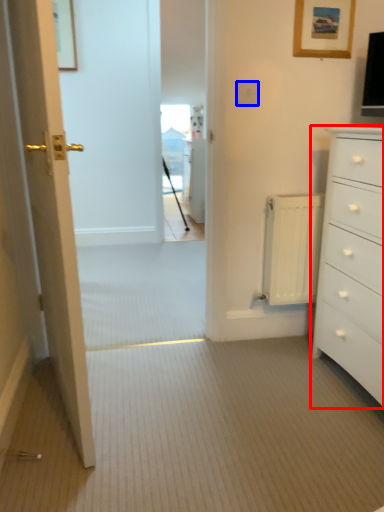
Question: Which point is further to the camera, chest of drawers (highlighted by a red box) or electric outlet (highlighted by a blue box)?

Choices:
 (A) chest of drawers
 (B) electric outlet

Answer: (B)